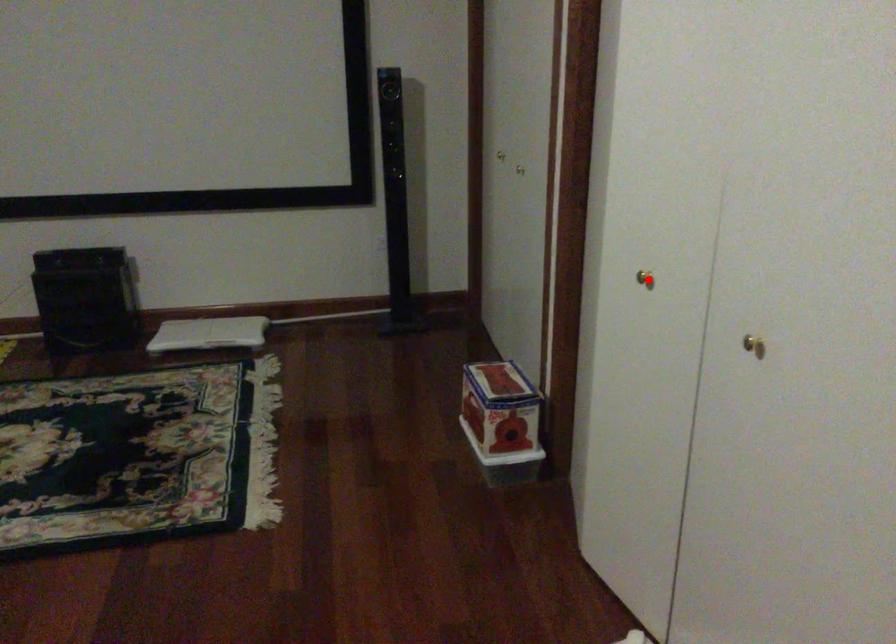
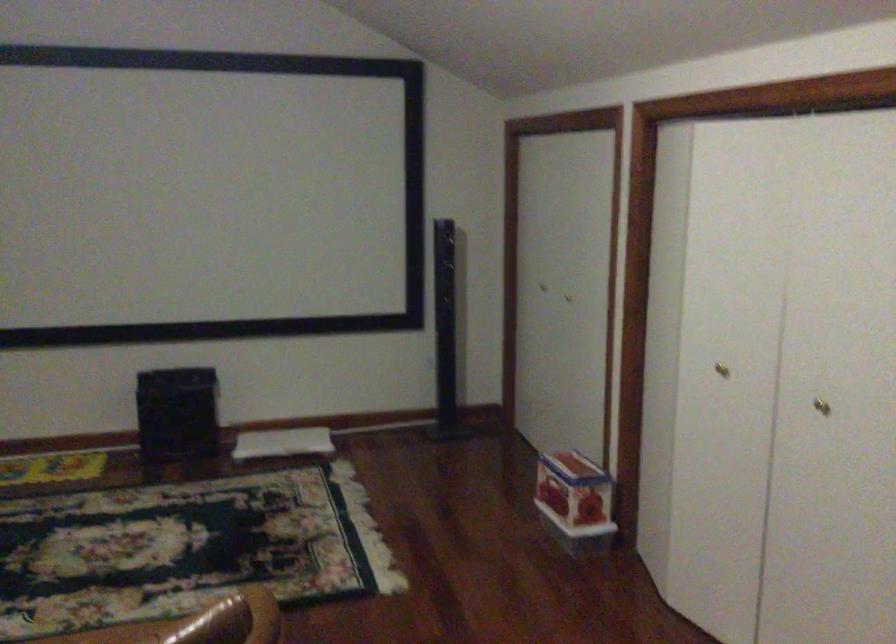
Locate, in the second image, the point that corresponds to the highlighted location in the first image.

(721, 368)